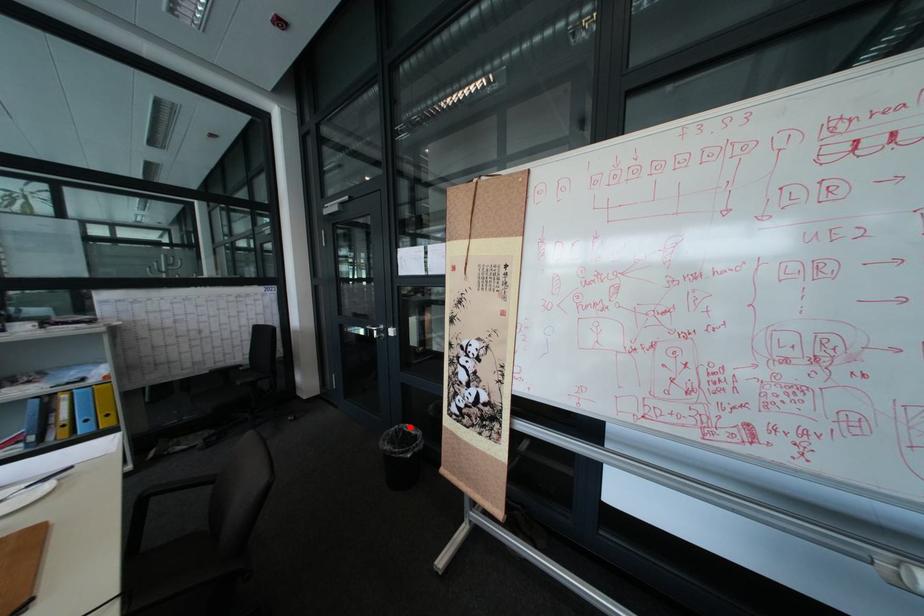
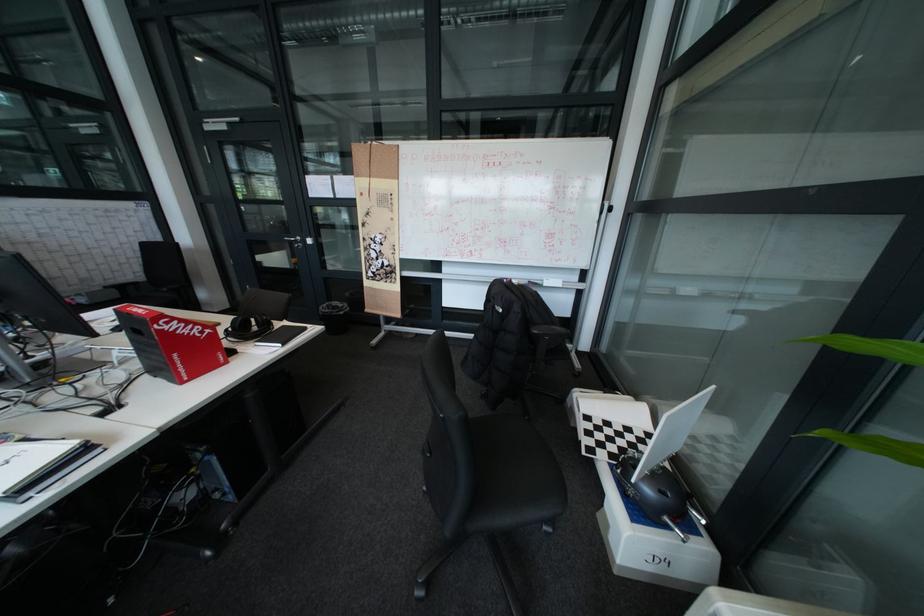
Question: I am providing you with two images of the same scene from different viewpoints. Given a red point in image1, look at the same physical point in image2. Is it:

Choices:
 (A) Closer to the viewpoint
 (B) Farther from the viewpoint

Answer: (B)